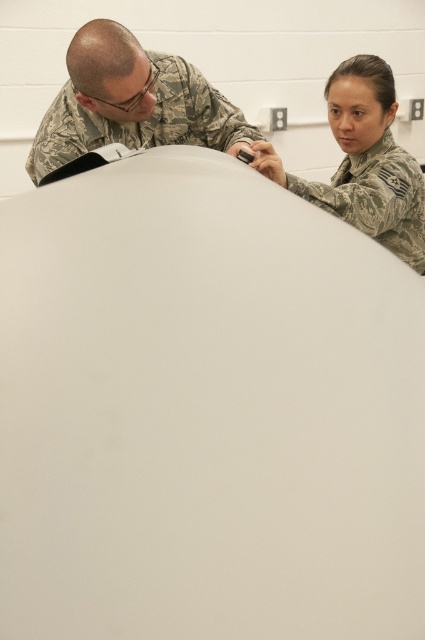
You are a maintenance technician standing at the camera position in the image. You need to reach point [209,129] to fix an issue. Can you safely reach it without moving more than 2 meters from your current position?

The distance of point [209,129] from the camera is 2.15 meters, which is beyond the 2 meters limit. Therefore, you cannot safely reach it without moving more than 2 meters from your current position.

You are a security guard in the facility and need to determine the relative positions of the two individuals in the image. Which person, the camouflage uniform at upper left or the camouflage uniform at upper right, is closer to you?

The camouflage uniform at upper left is closer to you because it is positioned over the camouflage uniform at upper right, indicating it is in front.